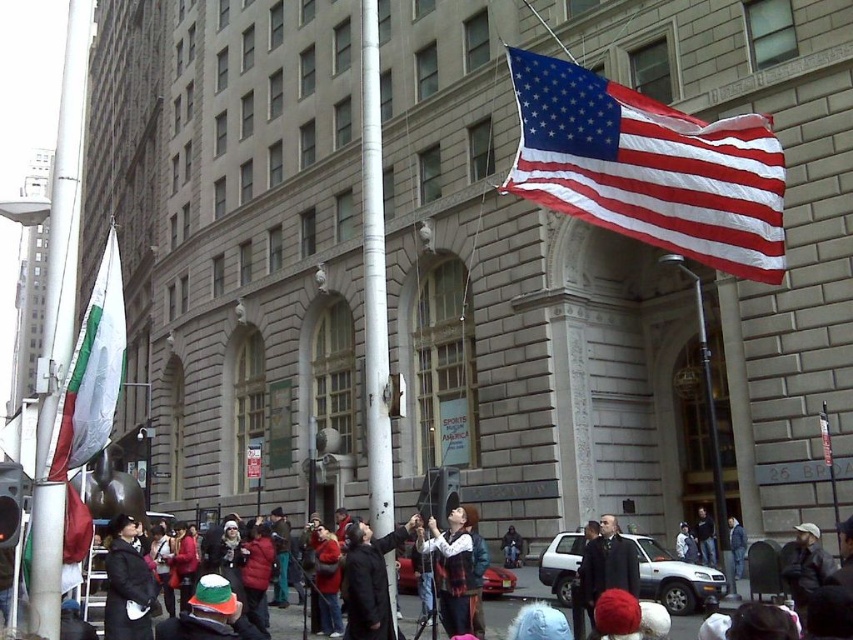
You are standing at point A located at point (x=703, y=204) and want to walk to point B which is 81.19 feet away. Is the path between the two points clear of any obstacles?

The path between point A located at point (x=703, y=204) and point B is clear of any obstacles as the scene description mentions a crowd of people but does not indicate any physical barriers blocking the path between them.

You are a photographer standing at the camera position. You want to capture a clear photo of the dark gray wool coat at lower center. Considering the distance, is it feasible to take a clear photo without zooming in?

The dark gray wool coat at lower center is 33.93 meters away from the camera. At this distance, it would be challenging to capture a clear photo without zooming in, as the subject would appear small and possibly blurred without sufficient magnification.

You are a photographer trying to capture the American flag at upper right and the matte black jacket at center in the same frame. Based on their positions, which object appears larger in the photo?

The American flag at upper right appears larger in the photo because it is closer to the viewer than the matte black jacket at center.